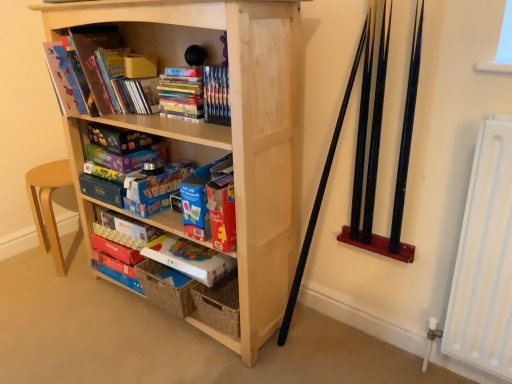
Question: Would you say red cardboard box at lower center, placed as the 2th paperback book when sorted from bottom to top, is to the left or to the right of matte cardboard book at center, which is the 4th paperback book in top-to-bottom order, in the picture?

Choices:
 (A) right
 (B) left

Answer: (B)

Question: Considering the positions of red cardboard box at lower center, placed as the 2th paperback book when sorted from bottom to top, and matte cardboard book at center, which is the 4th paperback book in top-to-bottom order, in the image, is red cardboard box at lower center, placed as the 2th paperback book when sorted from bottom to top, wider or thinner than matte cardboard book at center, which is the 4th paperback book in top-to-bottom order,?

Choices:
 (A) wide
 (B) thin

Answer: (B)

Question: Which object is positioned farthest from the blue cardboard box at center, which is counted as the 3th paperback book, starting from the top?

Choices:
 (A) red cardboard box at lower center, placed as the 2th paperback book when sorted from bottom to top
 (B) white cardboard game box at center, the first paperback book when ordered from bottom to top
 (C) matte purple board game at center, which appears as the second paperback book when viewed from the top
 (D) matte cardboard book at upper left, the second book when ordered from right to left
 (E) matte blue board game at center, which appears as the first paperback book when viewed from the top

Answer: (D)

Question: Estimate the real-world distances between objects in this image. Which object is farther from the natural wood bookcase at center?

Choices:
 (A) white cardboard game box at center, the sixth paperback book viewed from the top
 (B) matte cardboard book at upper left, the 1th book in the left-to-right sequence
 (C) matte blue board game at center, which appears as the first paperback book when viewed from the top
 (D) blue cardboard box at center, which is counted as the 3th paperback book, starting from the top
 (E) matte cardboard book at center, which is the 4th paperback book in top-to-bottom order

Answer: (E)